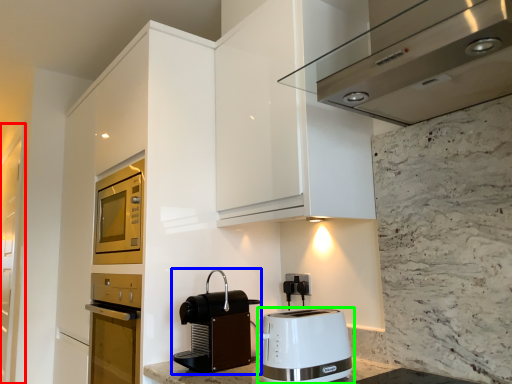
Question: Considering the real-world distances, which object is farthest from glass door (highlighted by a red box)? kitchen appliance (highlighted by a blue box) or toaster (highlighted by a green box)?

Choices:
 (A) kitchen appliance
 (B) toaster

Answer: (B)